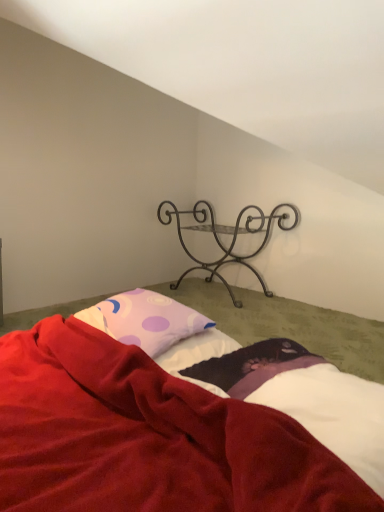
The image size is (384, 512). Identify the location of vacant area on top of white soft sheet at lower right (from a real-world perspective). (315, 372).